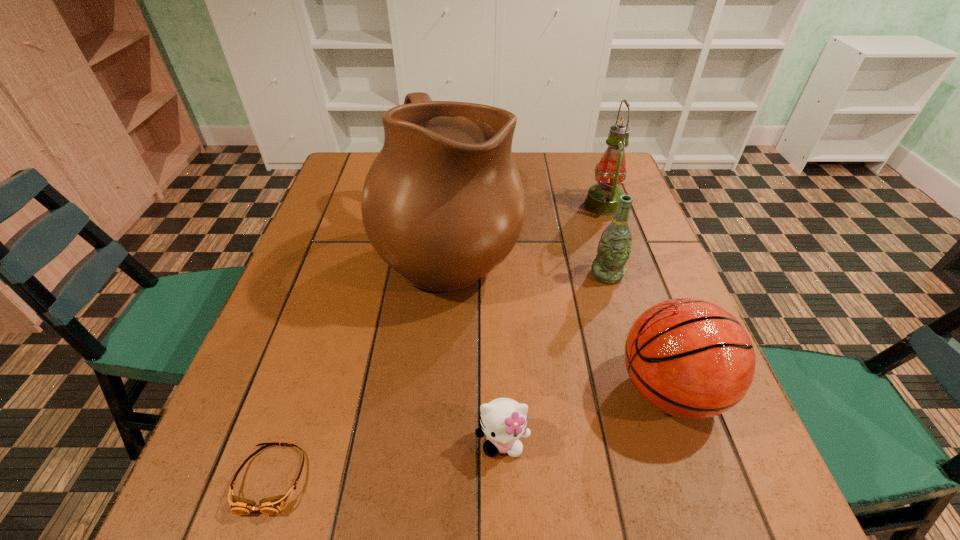
Where is `vacant region located 0.370m on the side with spill of the basketball`? The width and height of the screenshot is (960, 540). vacant region located 0.370m on the side with spill of the basketball is located at coordinates (418, 389).

This screenshot has height=540, width=960. What are the coordinates of `vacant region located on the side with spill of the basketball` in the screenshot? It's located at (444, 389).

Where is `vacant space situated on the side with spill of the basketball`? The image size is (960, 540). vacant space situated on the side with spill of the basketball is located at coordinates (466, 389).

You are a GUI agent. You are given a task and a screenshot of the screen. Output one action in this format:
    pyautogui.click(x=<x>, y=<y>)
    Task: Click on the free spot located 0.050m on the front-facing side of the kitten
    
    Given the screenshot: What is the action you would take?
    pyautogui.click(x=504, y=493)

This screenshot has width=960, height=540. What are the coordinates of `object present at the far edge` in the screenshot? It's located at (602, 198).

You are a GUI agent. You are given a task and a screenshot of the screen. Output one action in this format:
    pyautogui.click(x=<x>, y=<y>)
    Task: Click on the object that is at the near edge
    
    Given the screenshot: What is the action you would take?
    pyautogui.click(x=273, y=505)

The height and width of the screenshot is (540, 960). In order to click on object present at the left edge in this screenshot , I will do `click(273, 505)`.

This screenshot has width=960, height=540. In order to click on oil lamp present at the right edge in this screenshot , I will do `click(602, 198)`.

Where is `beer bottle that is at the right edge`? Image resolution: width=960 pixels, height=540 pixels. beer bottle that is at the right edge is located at coordinates (614, 248).

Where is `basketball present at the right edge`? This screenshot has height=540, width=960. basketball present at the right edge is located at coordinates (689, 358).